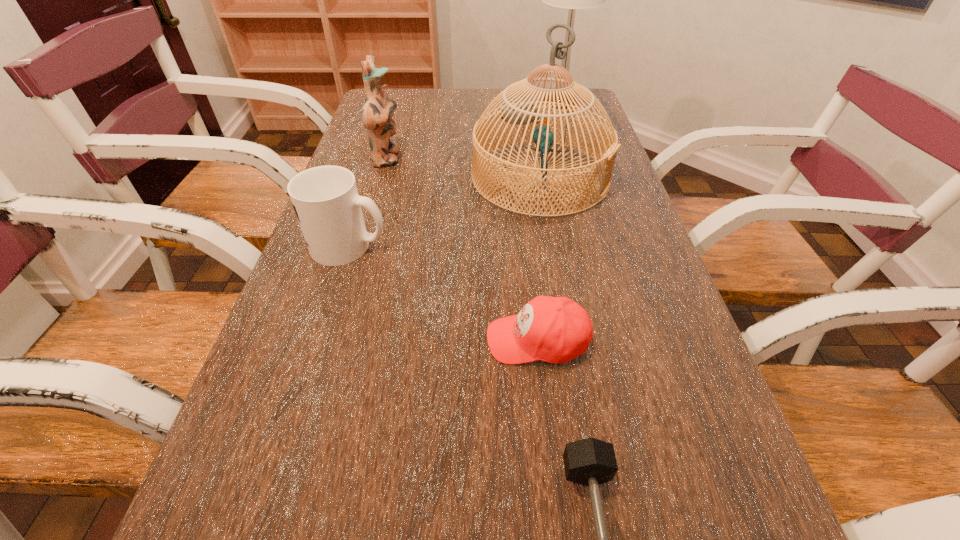
This screenshot has width=960, height=540. What are the coordinates of `free space located on the left of the second tallest object` in the screenshot? It's located at (453, 177).

Locate an element on the screen. free space located 0.220m on the front-facing side of the third tallest object is located at coordinates (480, 159).

At what (x,y) coordinates should I click in order to perform the action: click on vacant area located on the handle side of the fourth tallest object. Please return your answer as a coordinate pair (x, y). Looking at the image, I should click on (524, 246).

Locate an element on the screen. free space located on the front panel of the second nearest object is located at coordinates (404, 340).

At what (x,y) coordinates should I click in order to perform the action: click on free space located 0.240m on the front panel of the second nearest object. Please return your answer as a coordinate pair (x, y). Looking at the image, I should click on (354, 340).

The height and width of the screenshot is (540, 960). Find the location of `blank space located 0.090m on the front panel of the second nearest object`. blank space located 0.090m on the front panel of the second nearest object is located at coordinates (437, 340).

This screenshot has height=540, width=960. In order to click on object located in the far edge section of the desktop in this screenshot , I will do `click(572, 0)`.

At what (x,y) coordinates should I click in order to perform the action: click on figurine at the left edge. Please return your answer as a coordinate pair (x, y). This screenshot has width=960, height=540. Looking at the image, I should click on (378, 110).

At what (x,y) coordinates should I click in order to perform the action: click on mug situated at the left edge. Please return your answer as a coordinate pair (x, y). The width and height of the screenshot is (960, 540). Looking at the image, I should click on pos(325,198).

This screenshot has width=960, height=540. Identify the location of table lamp at the right edge. (572, 0).